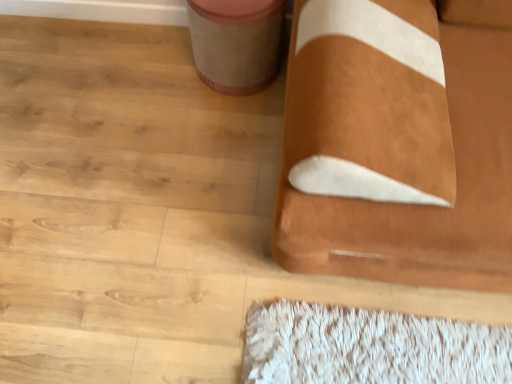
I want to click on brown suede pillow at center, so [x=396, y=147].

The height and width of the screenshot is (384, 512). What do you see at coordinates (396, 147) in the screenshot?
I see `brown suede pillow at center` at bounding box center [396, 147].

Measure the distance between brown suede pillow at center and camera.

The distance of brown suede pillow at center from camera is 28.85 inches.

Describe the element at coordinates (236, 43) in the screenshot. I see `matte beige potty at upper center` at that location.

What is the approximate width of matte beige potty at upper center?

The width of matte beige potty at upper center is 12.00 inches.

Locate an element on the screen. Image resolution: width=512 pixels, height=384 pixels. matte beige potty at upper center is located at coordinates (236, 43).

Identify the location of brown suede pillow at center. The image size is (512, 384). pos(396,147).

Which is more to the right, matte beige potty at upper center or brown suede pillow at center?

Result: brown suede pillow at center.

Which object is further away from the camera taking this photo, matte beige potty at upper center or brown suede pillow at center?

matte beige potty at upper center is further away from the camera.

Does point (252, 41) appear closer or farther from the camera than point (395, 266)?

Point (252, 41).

From the image's perspective, is matte beige potty at upper center below brown suede pillow at center?

No, from the image's perspective, matte beige potty at upper center is not below brown suede pillow at center.

From a real-world perspective, is matte beige potty at upper center on top of brown suede pillow at center?

Actually, matte beige potty at upper center is physically below brown suede pillow at center in the real world.

In terms of width, does matte beige potty at upper center look wider or thinner when compared to brown suede pillow at center?

matte beige potty at upper center is thinner than brown suede pillow at center.

Does matte beige potty at upper center have a lesser height compared to brown suede pillow at center?

Yes, matte beige potty at upper center is shorter than brown suede pillow at center.

Who is bigger, matte beige potty at upper center or brown suede pillow at center?

Bigger between the two is brown suede pillow at center.

Is matte beige potty at upper center surrounding brown suede pillow at center?

No, brown suede pillow at center is not inside matte beige potty at upper center.

Does matte beige potty at upper center touch brown suede pillow at center?

No, matte beige potty at upper center is not in contact with brown suede pillow at center.

Is matte beige potty at upper center positioned with its back to brown suede pillow at center?

No, brown suede pillow at center is not at the back of matte beige potty at upper center.

Can you tell me how much matte beige potty at upper center and brown suede pillow at center differ in facing direction?

1.19 degrees separate the facing orientations of matte beige potty at upper center and brown suede pillow at center.

Where is `furniture on the right of matte beige potty at upper center`? furniture on the right of matte beige potty at upper center is located at coordinates (396, 147).

Which is more to the left, brown suede pillow at center or matte beige potty at upper center?

From the viewer's perspective, matte beige potty at upper center appears more on the left side.

Which object is more forward, brown suede pillow at center or matte beige potty at upper center?

brown suede pillow at center is more forward.

Considering the positions of point (311, 83) and point (226, 1), is point (311, 83) closer or farther from the camera than point (226, 1)?

Point (311, 83) is positioned closer to the camera compared to point (226, 1).

From the image's perspective, between brown suede pillow at center and matte beige potty at upper center, who is located below?

brown suede pillow at center.

From a real-world perspective, is brown suede pillow at center beneath matte beige potty at upper center?

No, from a real-world perspective, brown suede pillow at center is not beneath matte beige potty at upper center.

Which of these two, brown suede pillow at center or matte beige potty at upper center, is wider?

brown suede pillow at center.

Which of these two, brown suede pillow at center or matte beige potty at upper center, stands taller?

Standing taller between the two is brown suede pillow at center.

Between brown suede pillow at center and matte beige potty at upper center, which one has larger size?

With larger size is brown suede pillow at center.

Is brown suede pillow at center inside or outside of matte beige potty at upper center?

brown suede pillow at center lies outside matte beige potty at upper center.

Is brown suede pillow at center touching matte beige potty at upper center?

brown suede pillow at center is not next to matte beige potty at upper center, and they're not touching.

Is matte beige potty at upper center at the back of brown suede pillow at center?

No.

How different are the orientations of brown suede pillow at center and matte beige potty at upper center in degrees?

There is a 1.19-degree angle between the facing directions of brown suede pillow at center and matte beige potty at upper center.

The image size is (512, 384). Identify the location of furniture above the matte beige potty at upper center (from a real-world perspective). (396, 147).

Where is `potty on the left side of brown suede pillow at center`? potty on the left side of brown suede pillow at center is located at coordinates (236, 43).

Locate an element on the screen. This screenshot has width=512, height=384. potty below the brown suede pillow at center (from a real-world perspective) is located at coordinates (236, 43).